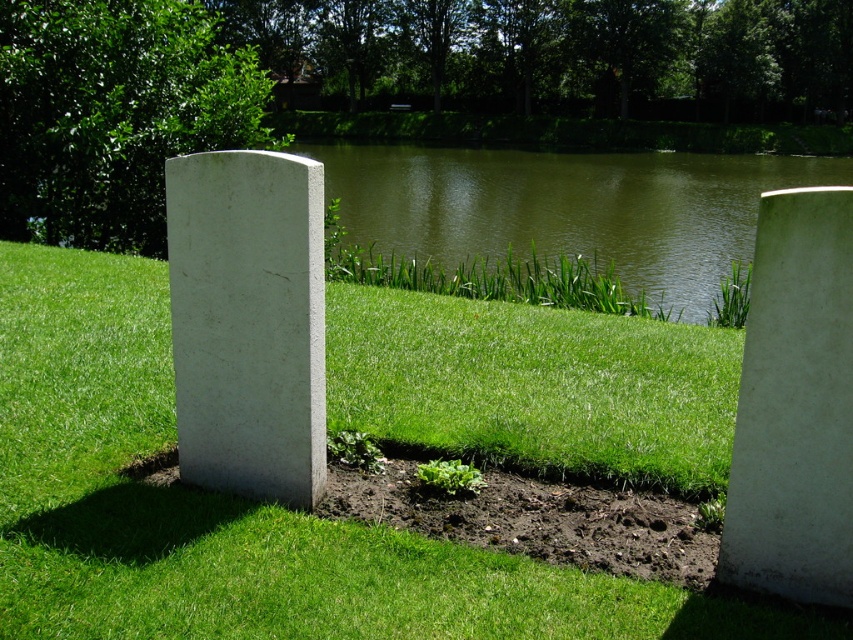
You are standing in the middle of the scene and want to walk towards the green water at center. Which direction should you walk relative to the white concrete at right?

The green water at center is to the right of the white concrete at right, so you should walk to the right relative to the white concrete at right to reach the green water at center.

You are standing at the edge of the water in the background and want to walk towards the white concrete at right. Which direction should you head to avoid stepping on the green grassy at center?

To reach the white concrete at right while avoiding the green grassy at center, you should walk towards the right side since the green grassy at center is located below the white concrete at right.

You are a landscape architect designing a new memorial garden. You need to determine which area is narrower between the green grassy at center and the green water at center in the image. Which one is narrower?

The green grassy at center has a lesser width compared to green water at center, so the green grassy at center is narrower.